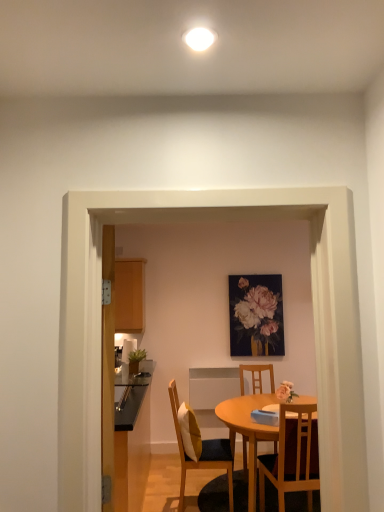
Question: In terms of height, does wooden chair at center, which is counted as the third chair, starting from the front, look taller or shorter compared to glossy black countertop at left?

Choices:
 (A) tall
 (B) short

Answer: (A)

Question: From a real-world perspective, relative to glossy black countertop at left, is wooden chair at center, which ranks as the 2th chair in right-to-left order, vertically above or below?

Choices:
 (A) below
 (B) above

Answer: (A)

Question: Considering the real-world distances, which object is closest to the matte black picture frame at center?

Choices:
 (A) wooden cushioned chair at center, the 1th chair from the left
 (B) wooden cabinet at left
 (C) wooden table at center
 (D) wooden chair at lower right, arranged as the 3th chair when viewed from the back
 (E) wooden chair at center, which is the 1th chair in back-to-front order

Answer: (E)

Question: Which is farther from the wooden chair at lower right, the first chair from the right?

Choices:
 (A) wooden cushioned chair at center, the 1th chair from the left
 (B) glossy black countertop at left
 (C) transparent glass door at center
 (D) matte black picture frame at center
 (E) wooden chair at center, which is the 1th chair in back-to-front order

Answer: (C)